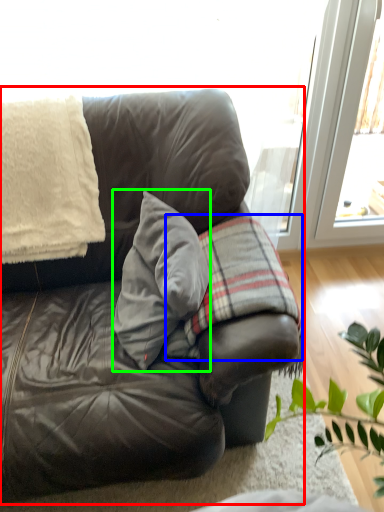
Question: Considering the real-world distances, which object is farthest from studio couch (highlighted by a red box)? plaid (highlighted by a blue box) or throw pillow (highlighted by a green box)?

Choices:
 (A) plaid
 (B) throw pillow

Answer: (A)